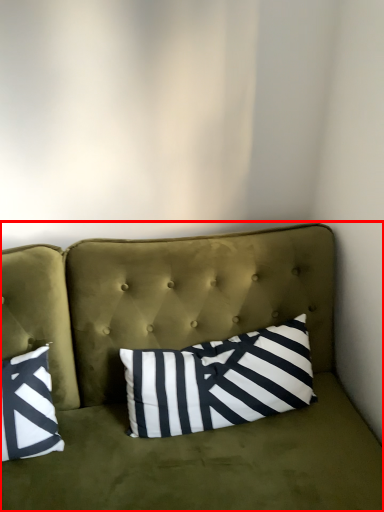
Question: Considering the relative positions of studio couch (annotated by the red box) and pillow in the image provided, where is studio couch (annotated by the red box) located with respect to the staircase?

Choices:
 (A) left
 (B) right

Answer: (A)